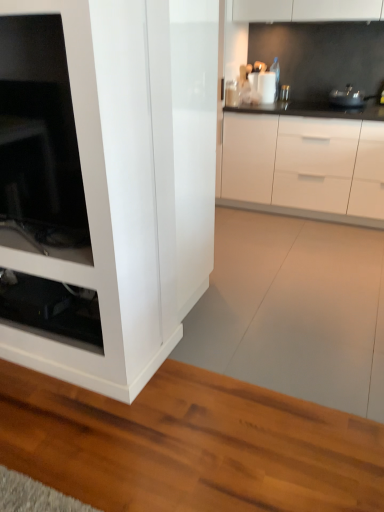
Question: Looking at the image, does transparent glass shelf at lower left seem bigger or smaller compared to metallic silver pot at upper right, the 1th appliance viewed from the right?

Choices:
 (A) small
 (B) big

Answer: (A)

Question: Does point (72, 286) appear closer or farther from the camera than point (334, 88)?

Choices:
 (A) closer
 (B) farther

Answer: (A)

Question: Based on their relative distances, which object is nearer to the metallic silver pot at upper right, the 1th appliance viewed from the right?

Choices:
 (A) transparent glass shelf at lower left
 (B) white glossy cabinet at center
 (C) white glossy container at upper center, arranged as the 2th appliance when viewed from the right

Answer: (C)

Question: Estimate the real-world distances between objects in this image. Which object is farther from the white glossy container at upper center, arranged as the 2th appliance when viewed from the right?

Choices:
 (A) transparent glass shelf at lower left
 (B) white glossy cabinet at center
 (C) metallic silver pot at upper right, the 1th appliance viewed from the right

Answer: (A)